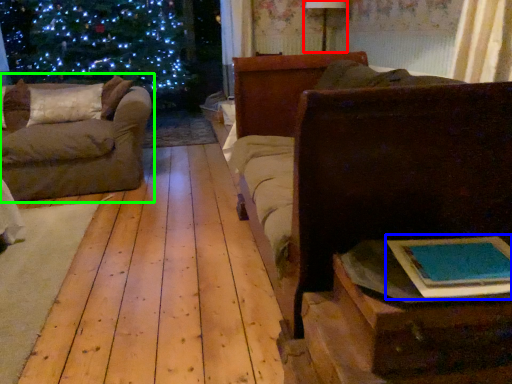
Question: Considering the real-world distances, which object is farthest from lamp (highlighted by a red box)? book (highlighted by a blue box) or studio couch (highlighted by a green box)?

Choices:
 (A) book
 (B) studio couch

Answer: (A)